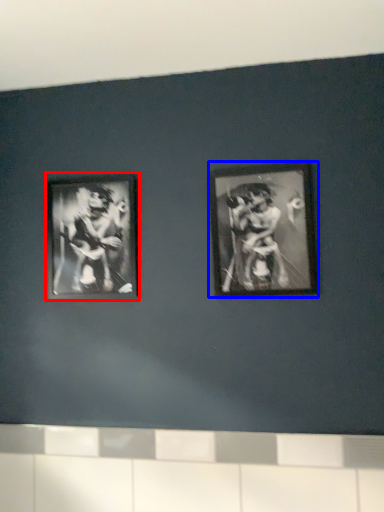
Question: Which object appears farthest to the camera in this image, picture frame (highlighted by a red box) or picture frame (highlighted by a blue box)?

Choices:
 (A) picture frame
 (B) picture frame

Answer: (A)